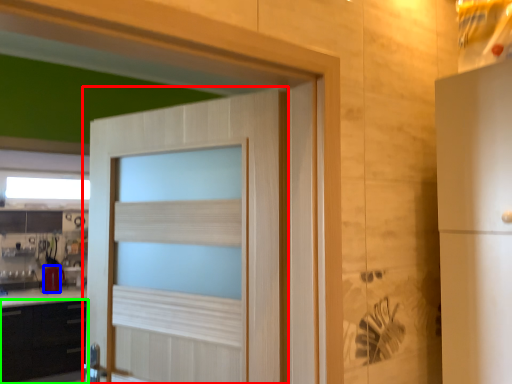
Question: Estimate the real-world distances between objects in this image. Which object is closer to door (highlighted by a red box), appliance (highlighted by a blue box) or cabinetry (highlighted by a green box)?

Choices:
 (A) appliance
 (B) cabinetry

Answer: (B)